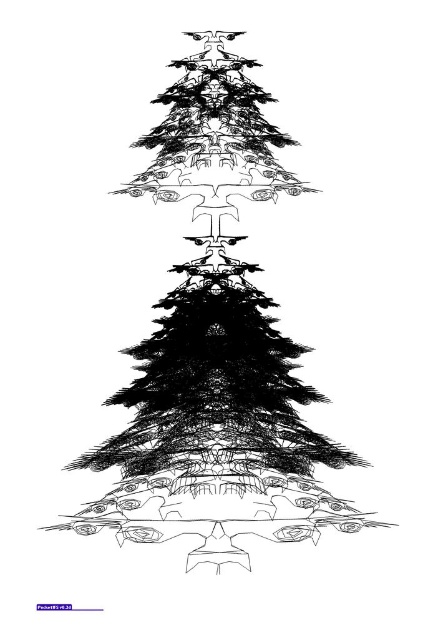
Question: Which point is closer to the camera taking this photo?

Choices:
 (A) (204, 481)
 (B) (130, 496)

Answer: (B)

Question: Does black ink drawing of christmas tree at center have a greater width compared to smooth textured base at center?

Choices:
 (A) yes
 (B) no

Answer: (B)

Question: Is black ink drawing of christmas tree at center positioned in front of smooth textured base at center?

Choices:
 (A) yes
 (B) no

Answer: (B)

Question: Which point appears closest to the camera in this image?

Choices:
 (A) (210, 346)
 (B) (281, 541)

Answer: (B)

Question: Does black ink drawing of christmas tree at center have a smaller size compared to smooth textured base at center?

Choices:
 (A) yes
 (B) no

Answer: (B)

Question: Among these points, which one is farthest from the camera?

Choices:
 (A) (389, 524)
 (B) (290, 184)

Answer: (B)